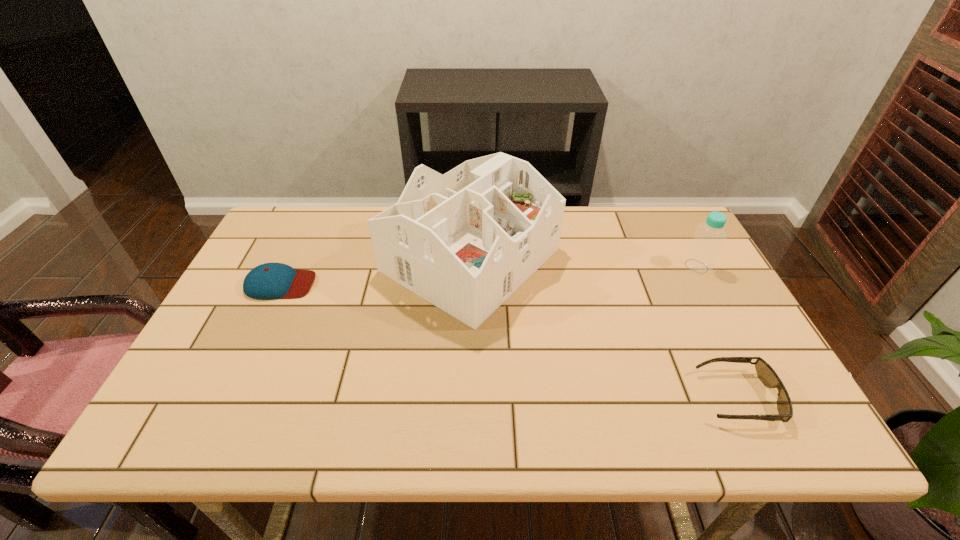
Find the location of a particular element. This screenshot has height=540, width=960. blank region between the leftmost object and the nearest object is located at coordinates (509, 341).

I want to click on free space between the nearest object and the leftmost object, so click(x=509, y=341).

At what (x,y) coordinates should I click in order to perform the action: click on the third closest object to the sunglasses. Please return your answer as a coordinate pair (x, y). This screenshot has width=960, height=540. Looking at the image, I should click on (267, 281).

Locate which object is the closest to the second object from left to right. Please provide its 2D coordinates. Your answer should be formatted as a tuple, i.e. [(x, y)], where the tuple contains the x and y coordinates of a point satisfying the conditions above.

[(267, 281)]

The width and height of the screenshot is (960, 540). What are the coordinates of `vacant area in the image that satisfies the following two spatial constraints: 1. on the front side of the third shortest object; 2. on the front-facing side of the sunglasses` in the screenshot? It's located at (767, 397).

Locate an element on the screen. vacant space that satisfies the following two spatial constraints: 1. on the front side of the third shortest object; 2. on the front-facing side of the nearest object is located at coordinates (767, 397).

You are a GUI agent. You are given a task and a screenshot of the screen. Output one action in this format:
    pyautogui.click(x=<x>, y=<y>)
    Task: Click on the free space that satisfies the following two spatial constraints: 1. on the front side of the bottle; 2. on the right side of the tallest object
    
    Given the screenshot: What is the action you would take?
    pyautogui.click(x=470, y=266)